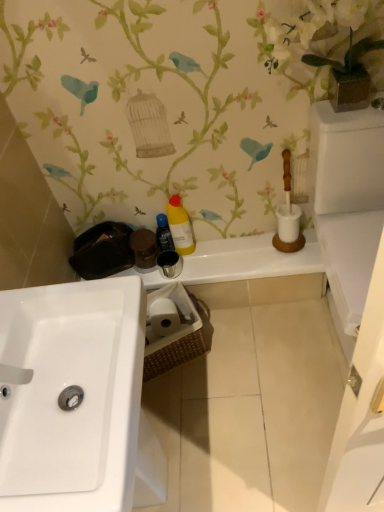
Identify the location of vacant area that is situated to the right of yellow matte bottle at center, arranged as the 1th cleaning product when viewed from the left. The image size is (384, 512). (222, 250).